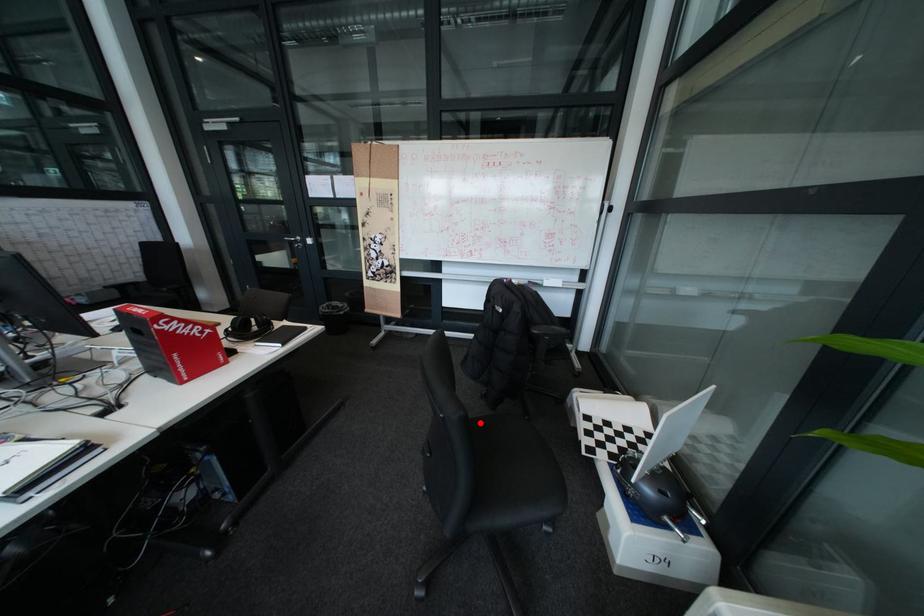
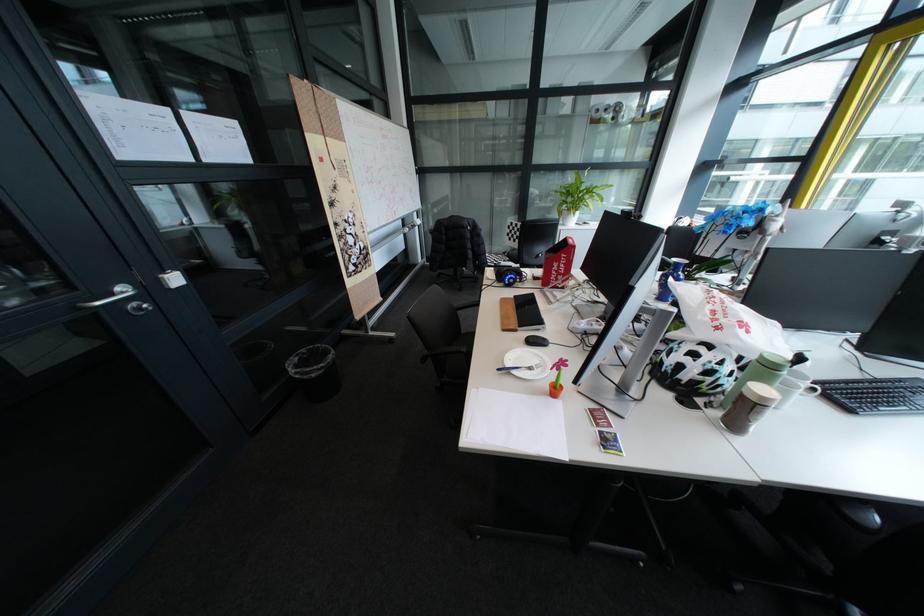
Question: I am providing you with two images of the same scene from different viewpoints. A red point is marked on the first image. At the location where the point appears in image 1, is it still visible in image 2?

Choices:
 (A) Yes
 (B) No

Answer: (B)